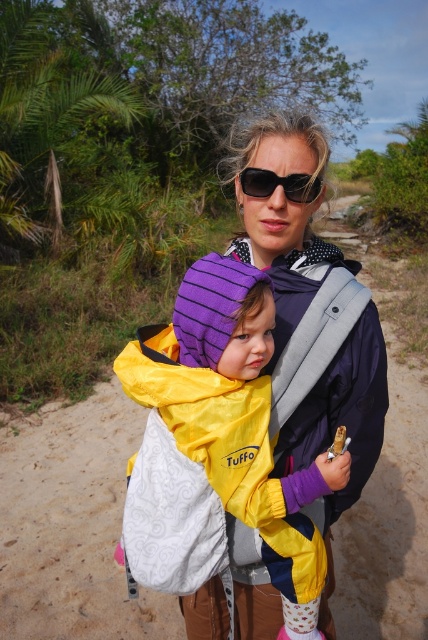
Question: Does matte black jacket at center have a lesser width compared to black plastic sunglasses at center?

Choices:
 (A) yes
 (B) no

Answer: (B)

Question: Estimate the real-world distances between objects in this image. Which object is farther from the matte black jacket at center?

Choices:
 (A) black plastic sunglasses at center
 (B) yellow fabric jacket at center

Answer: (A)

Question: Is yellow fabric jacket at center closer to the viewer compared to black plastic sunglasses at center?

Choices:
 (A) yes
 (B) no

Answer: (A)

Question: Based on their relative distances, which object is farther from the yellow fabric jacket at center?

Choices:
 (A) matte black jacket at center
 (B) black plastic sunglasses at center

Answer: (B)

Question: Does matte black jacket at center appear under black plastic sunglasses at center?

Choices:
 (A) no
 (B) yes

Answer: (B)

Question: Estimate the real-world distances between objects in this image. Which object is closer to the black plastic sunglasses at center?

Choices:
 (A) yellow fabric jacket at center
 (B) matte black jacket at center

Answer: (B)